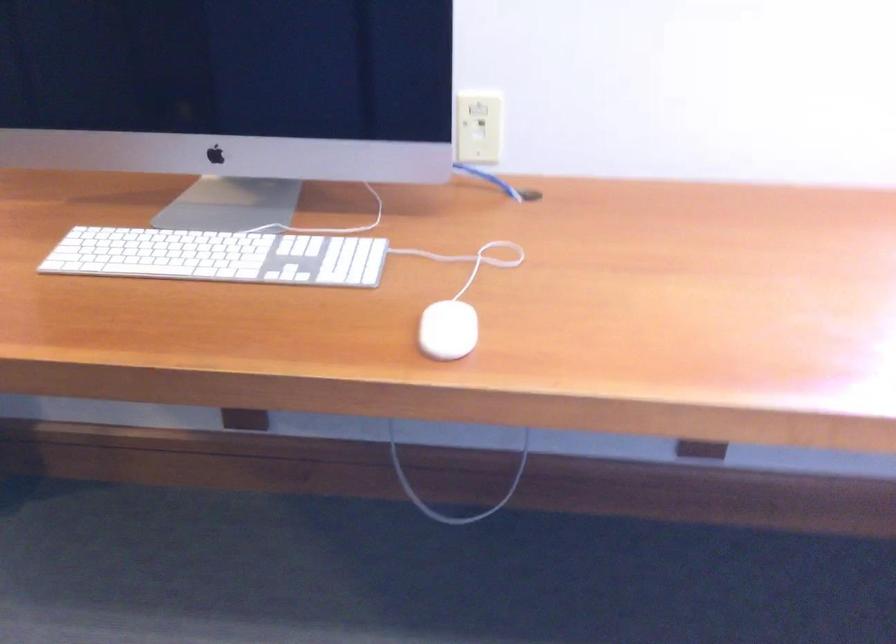
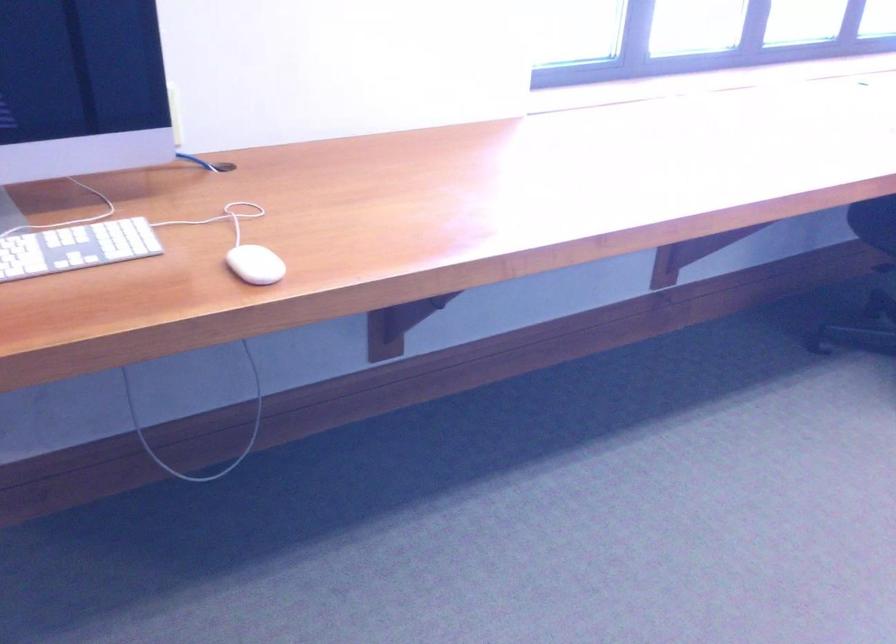
Find the pixel in the second image that matches (x=442, y=336) in the first image.

(254, 265)